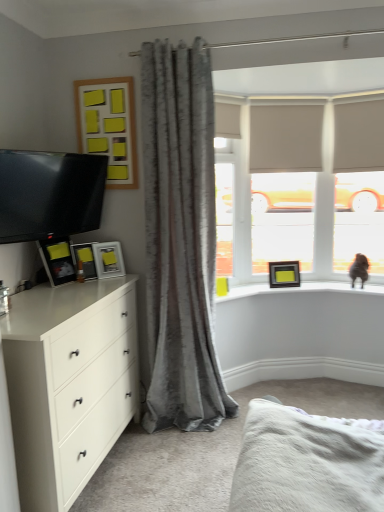
Find the location of `free space below matte black tv at left (from a real-world perspective)`. free space below matte black tv at left (from a real-world perspective) is located at coordinates (54, 286).